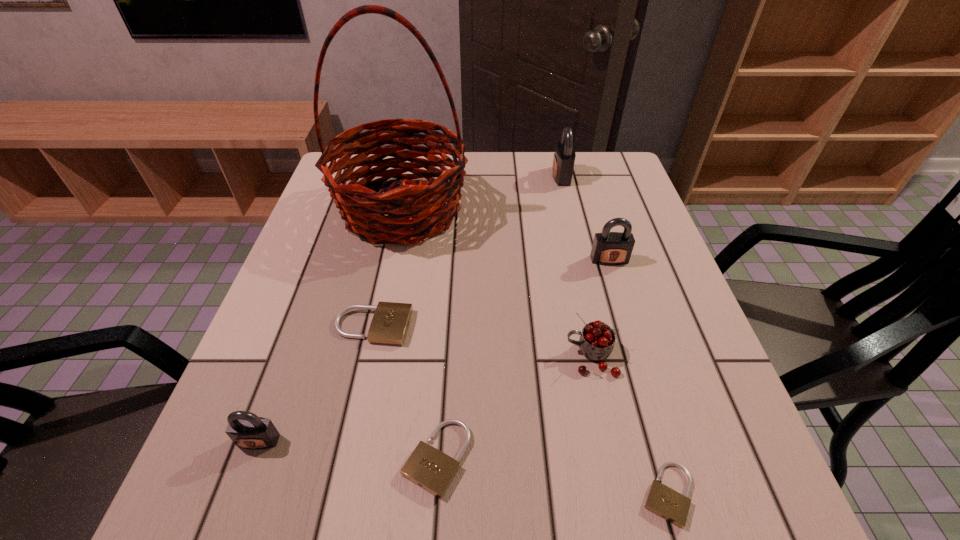
Image resolution: width=960 pixels, height=540 pixels. Find the location of `the second smallest beige padlock`. the second smallest beige padlock is located at coordinates (429, 468).

Identify the location of the second beige padlock from left to right. [x=429, y=468].

Image resolution: width=960 pixels, height=540 pixels. I want to click on the shortest object, so pos(669,504).

Find the location of a particular element. the smallest beige padlock is located at coordinates (669, 504).

You are a GUI agent. You are given a task and a screenshot of the screen. Output one action in this format:
    pyautogui.click(x=<x>, y=<y>)
    Task: Click on the vacant space located on the right of the basket
    
    Given the screenshot: What is the action you would take?
    pyautogui.click(x=620, y=210)

Locate an element on the screen. The width and height of the screenshot is (960, 540). free space located on the front of the farthest gray padlock near the keyhole is located at coordinates (490, 176).

Where is `vacant area situated 0.280m on the front of the farthest gray padlock near the keyhole`? vacant area situated 0.280m on the front of the farthest gray padlock near the keyhole is located at coordinates (456, 176).

Identify the location of vacant space positioned 0.380m on the front of the farthest gray padlock near the keyhole. This screenshot has width=960, height=540. (421, 176).

The height and width of the screenshot is (540, 960). I want to click on vacant space located on the front of the second nearest gray padlock near the keyhole, so click(631, 332).

Where is `vacant space located on the handle side of the red cherry`? The height and width of the screenshot is (540, 960). vacant space located on the handle side of the red cherry is located at coordinates (361, 357).